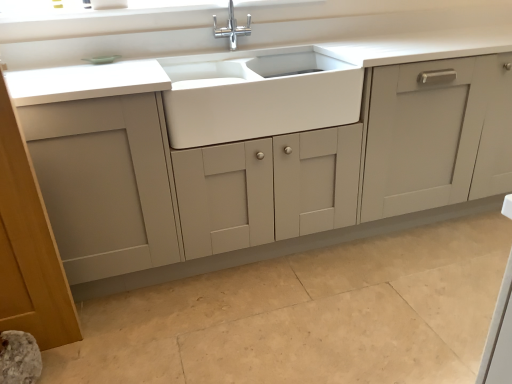
I want to click on white ceramic sink at center, so click(258, 94).

What do you see at coordinates (258, 94) in the screenshot?
I see `white ceramic sink at center` at bounding box center [258, 94].

This screenshot has height=384, width=512. Identify the location of white ceramic sink at center. tap(258, 94).